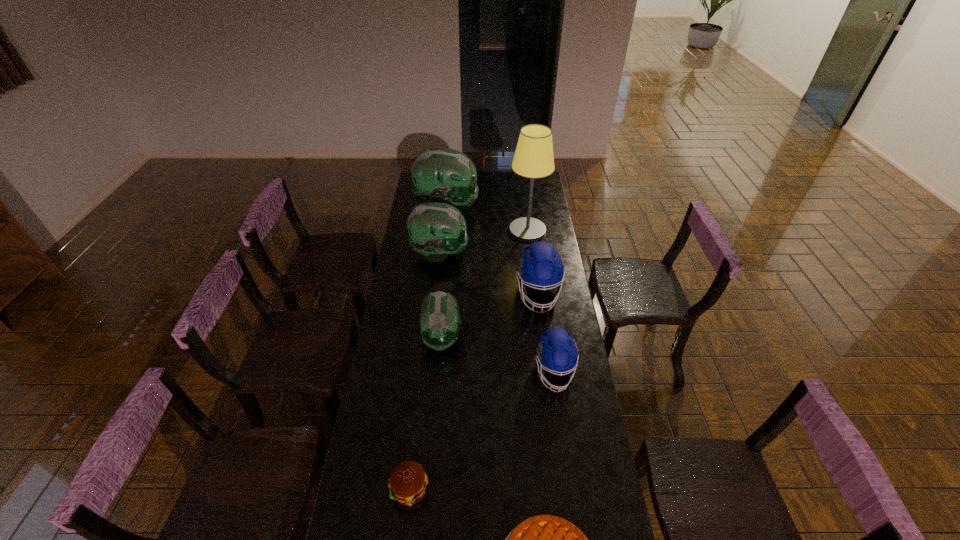
Identify the location of vacant space at the far edge of the desktop. Image resolution: width=960 pixels, height=540 pixels. (494, 188).

At what (x,y) coordinates should I click in order to perform the action: click on free space at the left edge of the desktop. Please return your answer as a coordinate pair (x, y). This screenshot has height=540, width=960. Looking at the image, I should click on coord(390,301).

Locate an element on the screen. free space at the right edge of the desktop is located at coordinates (602, 475).

This screenshot has height=540, width=960. I want to click on free space that is in between the nearest green football helmet and the smaller blue football helmet, so click(497, 355).

Where is `vacant region between the fourth farthest object and the smallest green football helmet`? The width and height of the screenshot is (960, 540). vacant region between the fourth farthest object and the smallest green football helmet is located at coordinates (490, 316).

Where is `free space that is in between the smaller blue football helmet and the brown hamburger`? The height and width of the screenshot is (540, 960). free space that is in between the smaller blue football helmet and the brown hamburger is located at coordinates (482, 430).

The height and width of the screenshot is (540, 960). Find the location of `empty location between the table lamp and the smallest green football helmet`. empty location between the table lamp and the smallest green football helmet is located at coordinates (485, 284).

Where is `free space between the fifth nearest object and the farthest football helmet`? The width and height of the screenshot is (960, 540). free space between the fifth nearest object and the farthest football helmet is located at coordinates (492, 251).

Where is `free space that is in between the smaller blue football helmet and the second nearest green football helmet`? free space that is in between the smaller blue football helmet and the second nearest green football helmet is located at coordinates (497, 313).

Locate an element on the screen. The image size is (960, 540). vacant area between the brown hamburger and the nearest green football helmet is located at coordinates (425, 414).